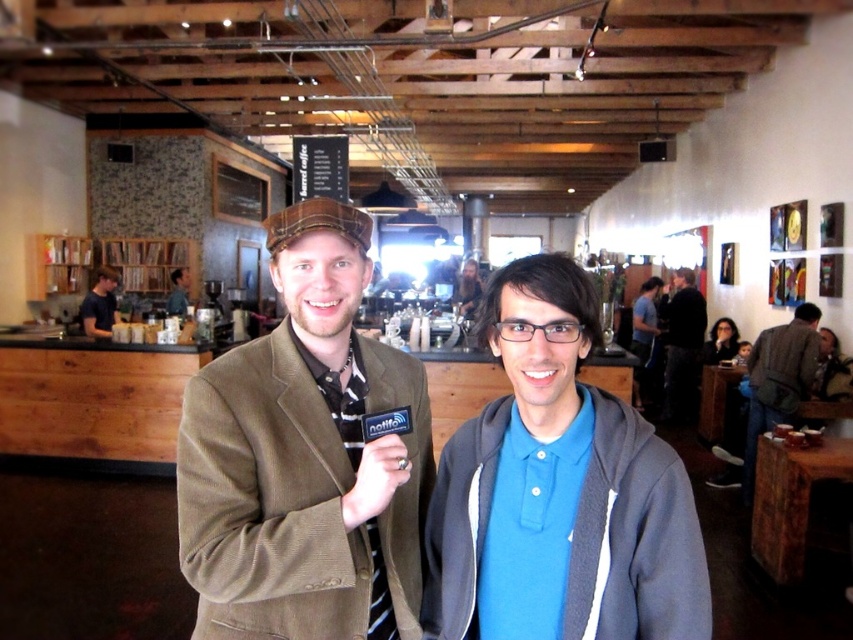
Question: Is brown leather backpack at right bigger than blue cotton shirt at center?

Choices:
 (A) no
 (B) yes

Answer: (A)

Question: Can you confirm if brown leather backpack at right is smaller than matte black hair at upper right?

Choices:
 (A) no
 (B) yes

Answer: (A)

Question: Which object appears closest to the camera in this image?

Choices:
 (A) brown leather backpack at right
 (B) dark blue shirt at left
 (C) blue cotton shirt at center

Answer: (A)

Question: Does brown corduroy jacket at center appear over brown leather backpack at right?

Choices:
 (A) yes
 (B) no

Answer: (A)

Question: Which point is farther to the camera?

Choices:
 (A) dark blue shirt at left
 (B) matte black hair at upper right

Answer: (B)

Question: Which point is farther to the camera?

Choices:
 (A) (88, 296)
 (B) (447, 579)
 (C) (206, 483)
 (D) (670, 305)

Answer: (D)